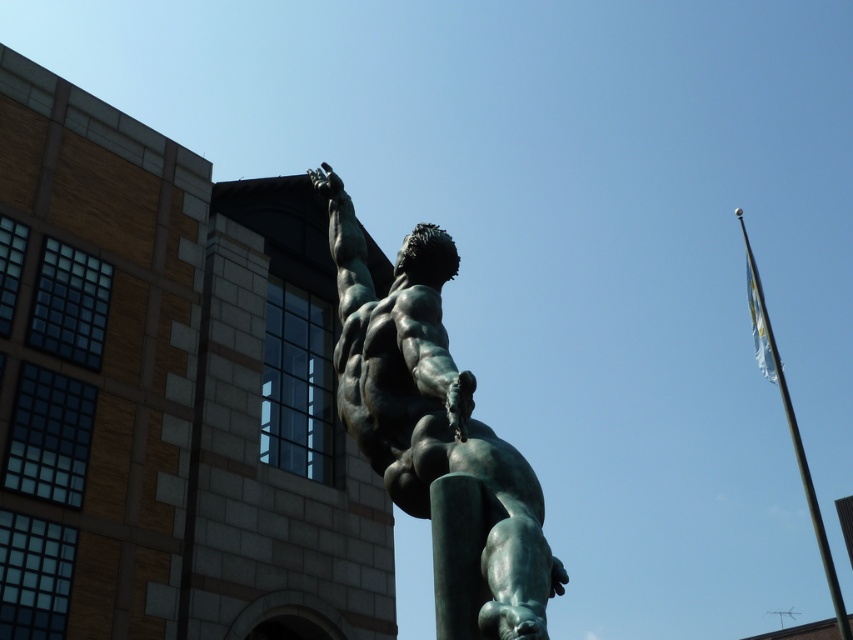
Looking at this image, between green patina statue at center and metallic flagpole at right, which one is positioned lower?

metallic flagpole at right is below.

Is green patina statue at center above metallic flagpole at right?

Indeed, green patina statue at center is positioned over metallic flagpole at right.

Which is behind, point (380, 461) or point (769, 369)?

Point (769, 369)

At what (x,y) coordinates should I click in order to perform the action: click on green patina statue at center. Please return your answer as a coordinate pair (x, y). This screenshot has width=853, height=640. Looking at the image, I should click on (436, 435).